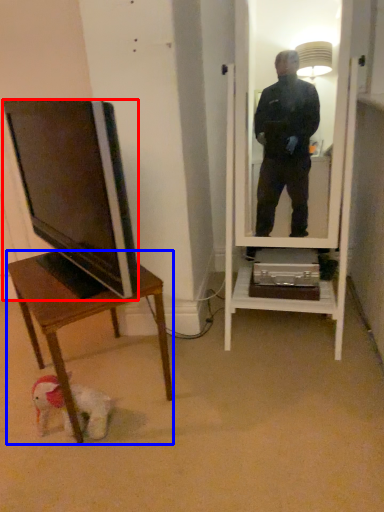
Question: Which object is further to the camera taking this photo, television (highlighted by a red box) or desk (highlighted by a blue box)?

Choices:
 (A) television
 (B) desk

Answer: (B)